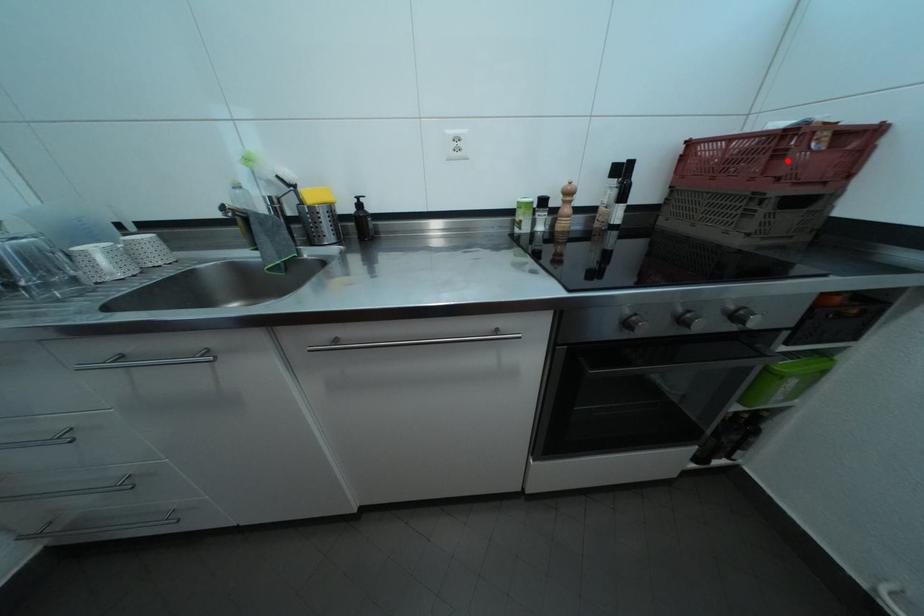
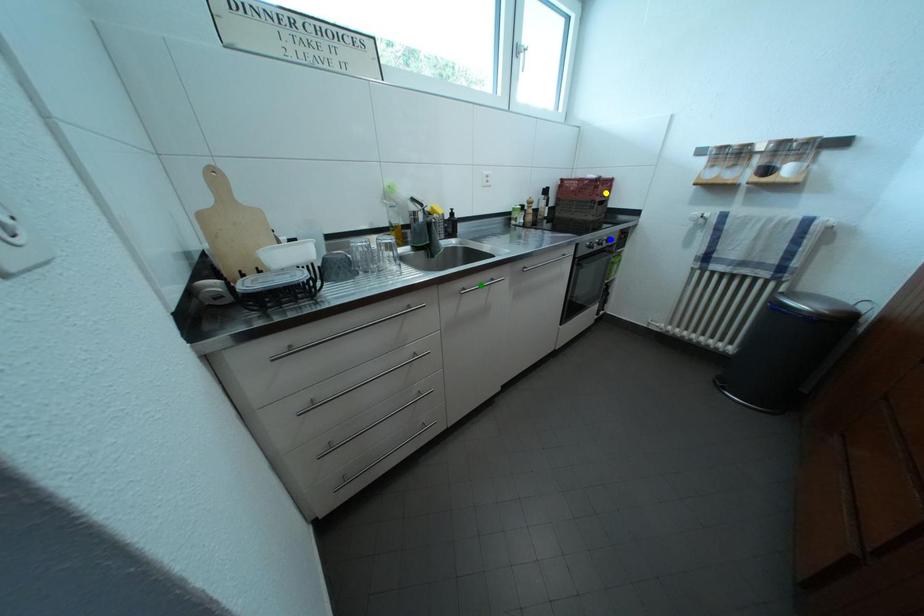
Question: I am providing you with two images of the same scene from different viewpoints. A red point is marked on the first image. You are given multiple points on the second image. Which point in image 2 represents the same 3d spot as the red point in image 1?

Choices:
 (A) green point
 (B) blue point
 (C) yellow point

Answer: (C)